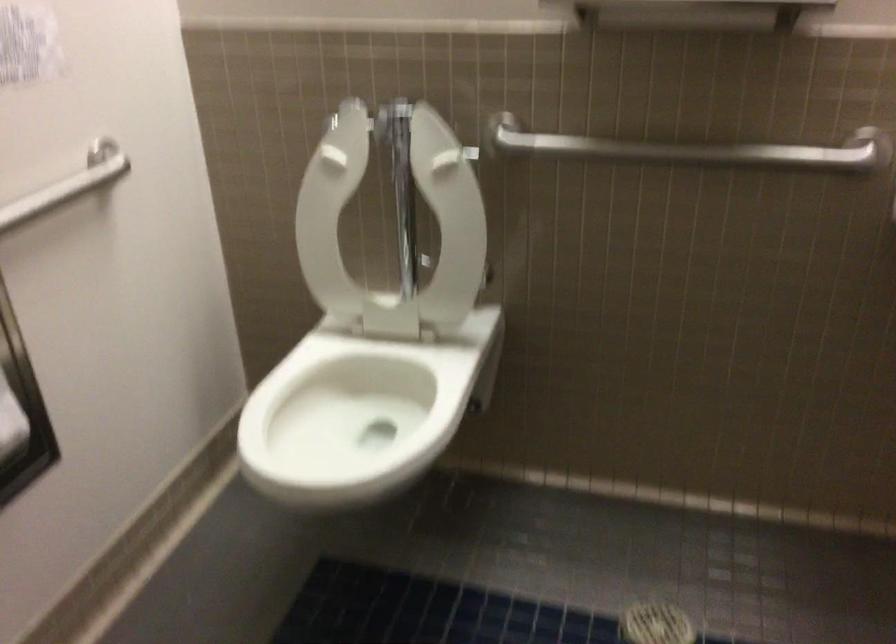
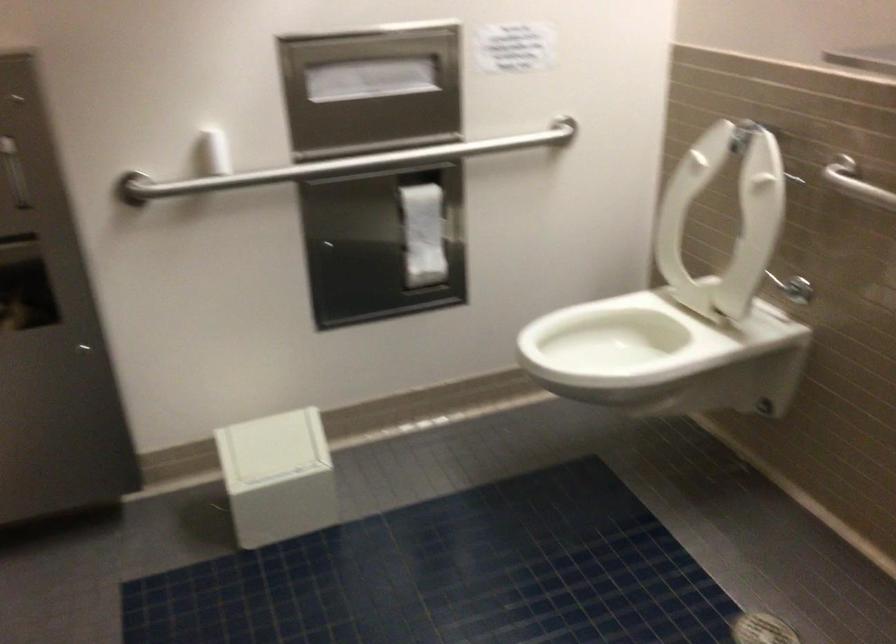
Question: The camera is either moving clockwise (left) or counter-clockwise (right) around the object. The first image is from the beginning of the video and the second image is from the end. Is the camera moving left or right when shooting the video?

Choices:
 (A) Left
 (B) Right

Answer: (B)